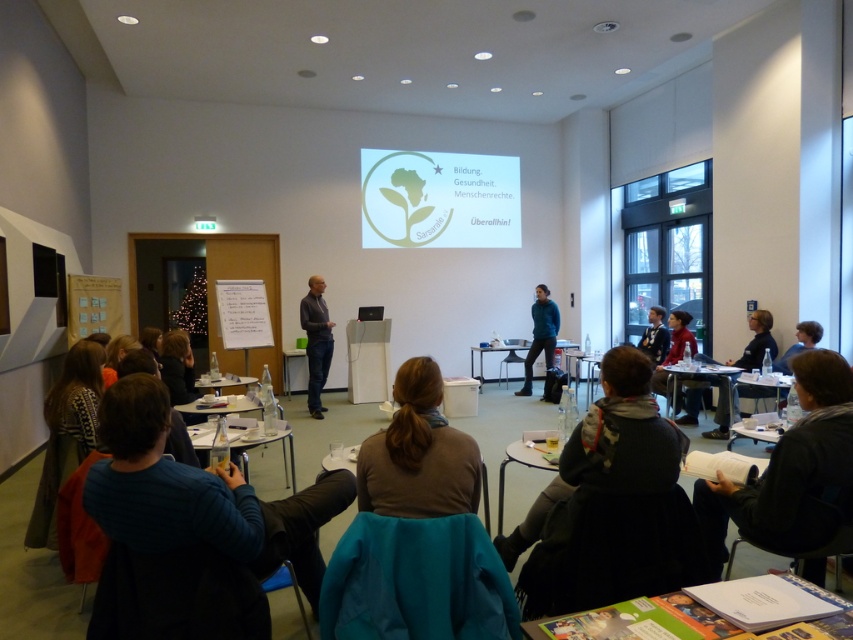
Question: Does white plastic table at lower right appear over clear plastic table at center?

Choices:
 (A) no
 (B) yes

Answer: (A)

Question: Is blue sweater at lower left to the left of dark gray sweater at lower right from the viewer's perspective?

Choices:
 (A) no
 (B) yes

Answer: (B)

Question: Which point is closer to the camera?

Choices:
 (A) (746, 532)
 (B) (517, 541)

Answer: (A)

Question: Which of the following is the farthest from the observer?

Choices:
 (A) metallic silver table at center
 (B) green matte projection screen at upper center
 (C) clear plastic table at center
 (D) wooden table at lower center

Answer: (B)

Question: Which is nearer to the dark gray sweater at lower right?

Choices:
 (A) matte black jacket at center
 (B) blue matte sweater at center
 (C) matte plastic table at center
 (D) wooden table at lower center

Answer: (D)

Question: Can you confirm if paper-covered table at lower center is positioned to the left of blue matte sweater at center?

Choices:
 (A) no
 (B) yes

Answer: (B)